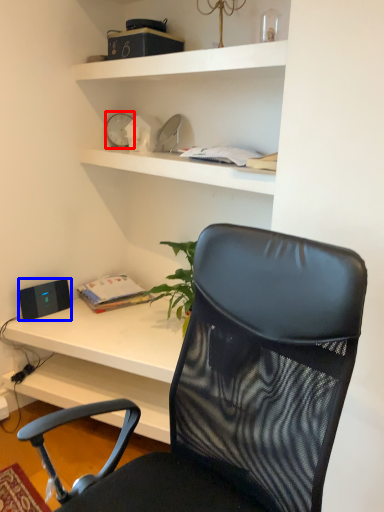
Question: Which object appears closest to the camera in this image, clock (highlighted by a red box) or speaker (highlighted by a blue box)?

Choices:
 (A) clock
 (B) speaker

Answer: (B)